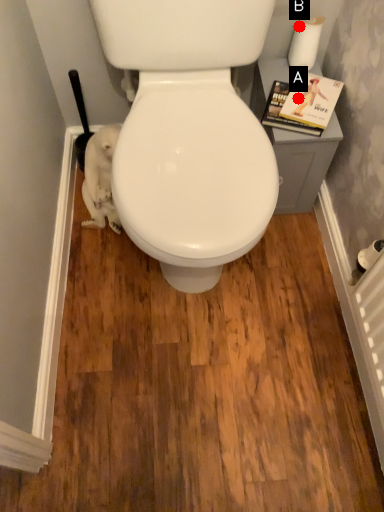
Question: Two points are circled on the image, labeled by A and B beside each circle. Among these points, which one is farthest from the camera?

Choices:
 (A) A is further
 (B) B is further

Answer: (B)